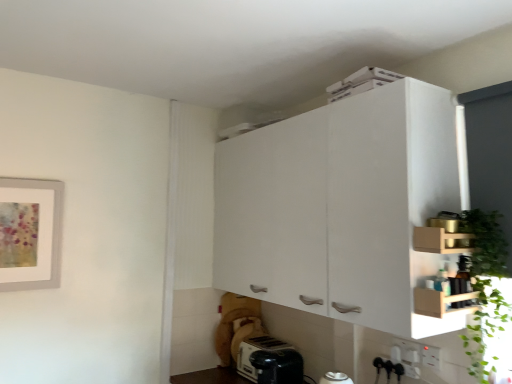
Question: From a real-world perspective, is white plastic electric outlet at lower right, the second electric outlet positioned from the left, positioned above or below wooden shelf at upper right, arranged as the 1th cabinetry when viewed from the front?

Choices:
 (A) above
 (B) below

Answer: (B)

Question: Is point (426, 360) closer or farther from the camera than point (431, 248)?

Choices:
 (A) farther
 (B) closer

Answer: (A)

Question: Considering the real-world distances, which object is closest to the white plastic electric outlet at lower right, the 1th electric outlet in the front-to-back sequence?

Choices:
 (A) white plastic toaster at lower center
 (B) white plastic electric outlet at lower right, which is the 2th electric outlet from front to back
 (C) green leafy plant at right
 (D) wooden shelf at upper right, arranged as the 1th cabinetry when viewed from the front
 (E) white matte cabinet at upper center, the first cabinetry positioned from the back

Answer: (B)

Question: Estimate the real-world distances between objects in this image. Which object is closer to the white matte cabinet at upper center, which is the 2th cabinetry in front-to-back order?

Choices:
 (A) white plastic electric outlet at lower right, placed as the 1th electric outlet when sorted from right to left
 (B) white plastic toaster at lower center
 (C) wooden shelf at upper right, arranged as the 1th cabinetry when viewed from the front
 (D) white plastic electric outlet at lower right, which appears as the 1th electric outlet when viewed from the back
 (E) green leafy plant at right

Answer: (C)